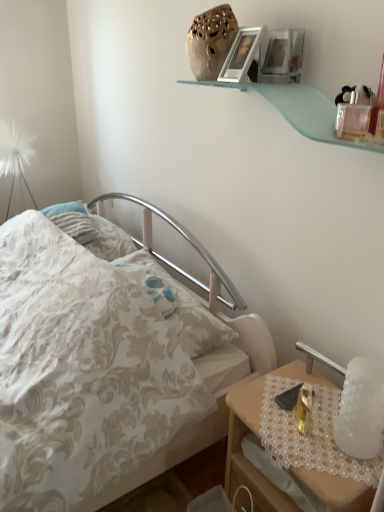
Question: Does white floral fabric bed at center contain wooden nightstand at lower right?

Choices:
 (A) yes
 (B) no

Answer: (B)

Question: Does white floral fabric bed at center lie in front of wooden nightstand at lower right?

Choices:
 (A) no
 (B) yes

Answer: (B)

Question: Is white floral fabric bed at center positioned far away from wooden nightstand at lower right?

Choices:
 (A) no
 (B) yes

Answer: (A)

Question: Is white floral fabric bed at center looking in the opposite direction of wooden nightstand at lower right?

Choices:
 (A) yes
 (B) no

Answer: (B)

Question: Can you confirm if white floral fabric bed at center is wider than wooden nightstand at lower right?

Choices:
 (A) yes
 (B) no

Answer: (A)

Question: In terms of width, does clear plastic perfume bottle at upper right look wider or thinner when compared to white frosted glass bedside lamp at right?

Choices:
 (A) thin
 (B) wide

Answer: (A)

Question: From their relative heights in the image, would you say clear plastic perfume bottle at upper right is taller or shorter than white frosted glass bedside lamp at right?

Choices:
 (A) short
 (B) tall

Answer: (A)

Question: Is clear plastic perfume bottle at upper right to the left or to the right of white frosted glass bedside lamp at right in the image?

Choices:
 (A) left
 (B) right

Answer: (A)

Question: From the image's perspective, is clear plastic perfume bottle at upper right located above or below white frosted glass bedside lamp at right?

Choices:
 (A) above
 (B) below

Answer: (A)

Question: Considering the relative positions of matte silver picture frame at upper center and clear plastic perfume bottle at upper right in the image provided, is matte silver picture frame at upper center to the left or to the right of clear plastic perfume bottle at upper right?

Choices:
 (A) right
 (B) left

Answer: (B)

Question: From the image's perspective, is matte silver picture frame at upper center positioned above or below clear plastic perfume bottle at upper right?

Choices:
 (A) above
 (B) below

Answer: (A)

Question: Considering the positions of matte silver picture frame at upper center and clear plastic perfume bottle at upper right in the image, is matte silver picture frame at upper center wider or thinner than clear plastic perfume bottle at upper right?

Choices:
 (A) wide
 (B) thin

Answer: (A)

Question: From a real-world perspective, is matte silver picture frame at upper center physically located above or below clear plastic perfume bottle at upper right?

Choices:
 (A) above
 (B) below

Answer: (A)

Question: Is clear plastic perfume bottle at upper right bigger or smaller than white floral fabric bed at center?

Choices:
 (A) big
 (B) small

Answer: (B)

Question: From the image's perspective, relative to white floral fabric bed at center, is clear plastic perfume bottle at upper right above or below?

Choices:
 (A) below
 (B) above

Answer: (B)